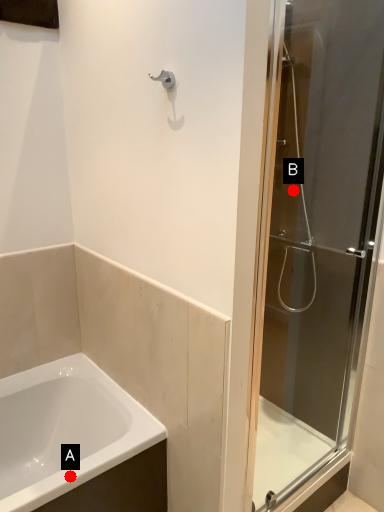
Question: Two points are circled on the image, labeled by A and B beside each circle. Which point is closer to the camera taking this photo?

Choices:
 (A) A is closer
 (B) B is closer

Answer: (A)